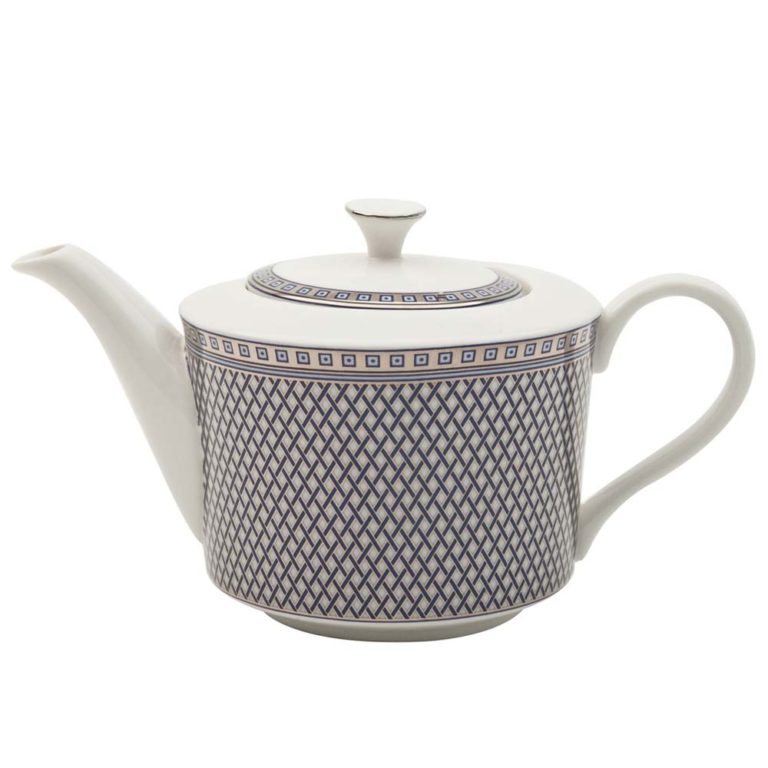
Where is `teapot lid`? teapot lid is located at coordinates (412, 276).